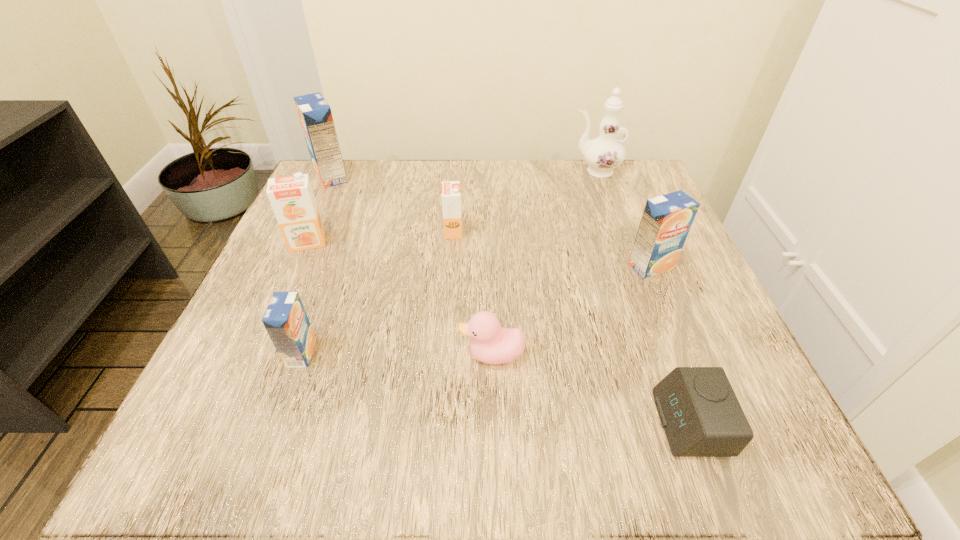
At what (x,y) coordinates should I click in order to perform the action: click on empty space between the duckling and the nearest blue orange_juice. Please return your answer as a coordinate pair (x, y). Looking at the image, I should click on (396, 354).

Locate an element on the screen. Image resolution: width=960 pixels, height=540 pixels. object that stands as the fourth closest to the biggest blue orange_juice is located at coordinates (492, 344).

What are the coordinates of `object identified as the sixth closest to the fourth nearest object` in the screenshot? It's located at (292, 199).

Locate an element on the screen. orange juice that stands as the closest to the alarm clock is located at coordinates (666, 220).

The image size is (960, 540). What are the coordinates of `orange juice that is the closest to the fourth farthest orange juice` in the screenshot? It's located at (451, 195).

You are a GUI agent. You are given a task and a screenshot of the screen. Output one action in this format:
    pyautogui.click(x=<x>, y=<y>)
    Task: Click on the blue orange_juice identified as the third closest to the fifth object from left to right
    
    Given the screenshot: What is the action you would take?
    pyautogui.click(x=315, y=115)

Identify the location of the second closest blue orange_juice to the tallest orange juice. (666, 220).

Identify the location of vacant point that satisfies the following two spatial constraints: 1. on the front side of the leftmost blue orange_juice; 2. on the left side of the second farthest blue orange_juice. The width and height of the screenshot is (960, 540). (290, 266).

This screenshot has height=540, width=960. I want to click on vacant position in the image that satisfies the following two spatial constraints: 1. on the front side of the bigger orange orange juice; 2. on the left side of the second blue orange_juice from right to left, so tap(259, 353).

This screenshot has height=540, width=960. I want to click on vacant space that satisfies the following two spatial constraints: 1. on the back side of the second biggest blue orange_juice; 2. on the left side of the second blue orange_juice from right to left, so click(x=332, y=266).